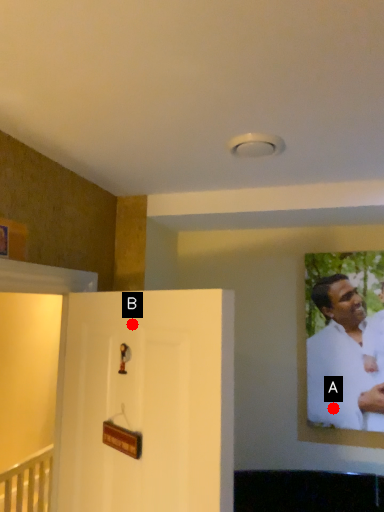
Question: Two points are circled on the image, labeled by A and B beside each circle. Which point is closer to the camera?

Choices:
 (A) A is closer
 (B) B is closer

Answer: (B)